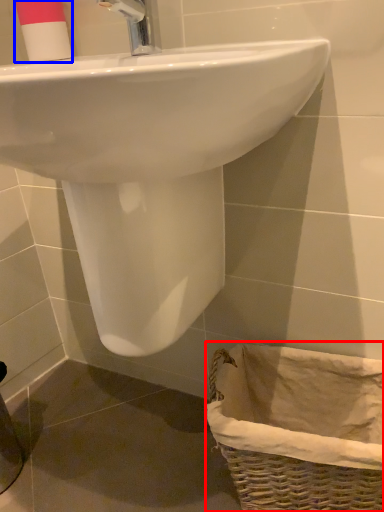
Question: Among these objects, which one is nearest to the camera, basket (highlighted by a red box) or toiletry (highlighted by a blue box)?

Choices:
 (A) basket
 (B) toiletry

Answer: (A)